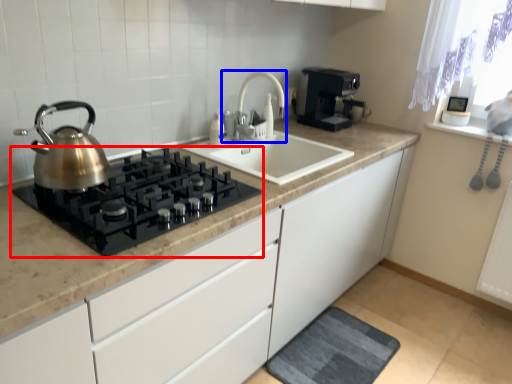
Question: Which object is further to the camera taking this photo, gas stove (highlighted by a red box) or tap (highlighted by a blue box)?

Choices:
 (A) gas stove
 (B) tap

Answer: (B)